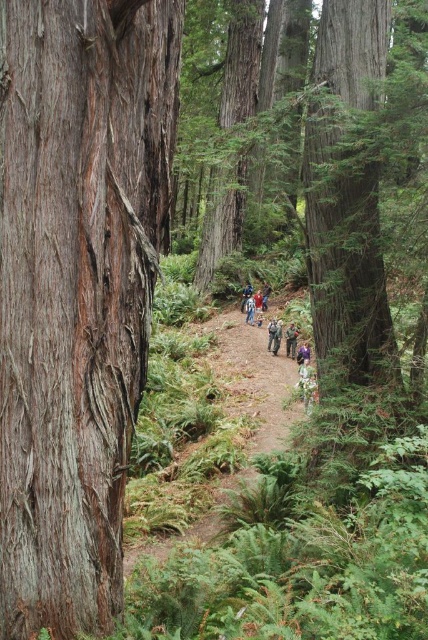
Based on the photo, you are a hiker walking along the narrow dirt path through the dense forest of towering redwood trees. You notice a specific point marked at coordinates (77, 289). What type of bark texture can you observe at that exact point?

At point (77, 289), there is smooth brown bark at center.

You are a hiker carrying a camouflage jacket at center and standing near a smooth brown bark at center. You want to hang your jacket on a hook attached to the bark. Is the bark tall enough to place the hook at a height where the jacket won

The smooth brown bark at center has a greater height compared to camouflage jacket at center. Therefore, the smooth brown bark at center is tall enough to place the hook at a height where the jacket won